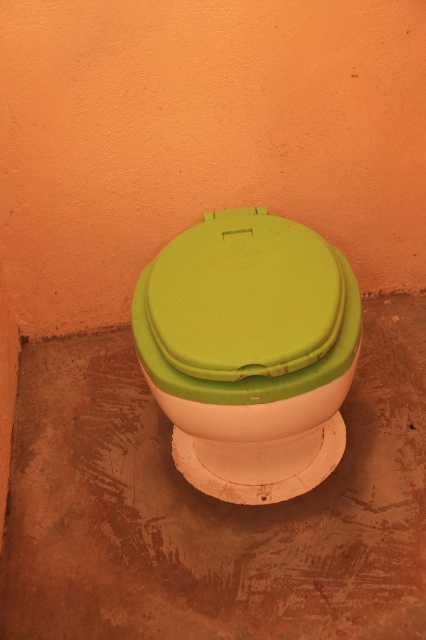
Question: Does green matte toilet lid at center lie in front of green matte toilet bowl at center?

Choices:
 (A) yes
 (B) no

Answer: (A)

Question: Does green matte toilet lid at center appear under green matte toilet bowl at center?

Choices:
 (A) no
 (B) yes

Answer: (A)

Question: Can you confirm if green matte toilet lid at center is positioned above green matte toilet bowl at center?

Choices:
 (A) yes
 (B) no

Answer: (A)

Question: Which point is farther from the camera taking this photo?

Choices:
 (A) (259, 349)
 (B) (265, 420)

Answer: (B)